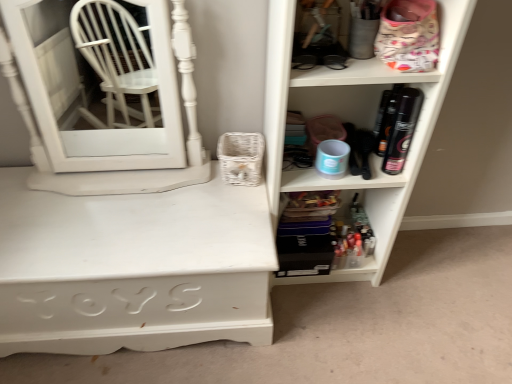
Find the location of a particular element. vacant space that's between matte white shelf at right, which ranks as the 2th shelf in bottom-to-top order, and white painted wood desk at lower left is located at coordinates (312, 309).